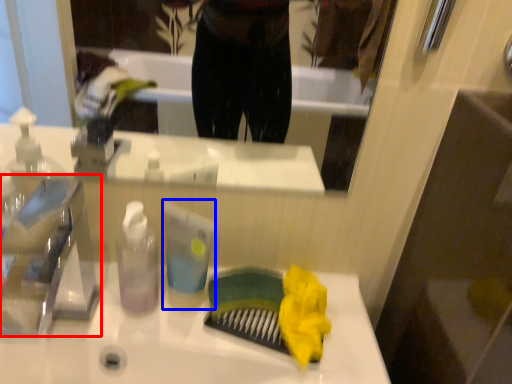
Question: Which point is closer to the camera, faucet (highlighted by a red box) or toiletry (highlighted by a blue box)?

Choices:
 (A) faucet
 (B) toiletry

Answer: (A)